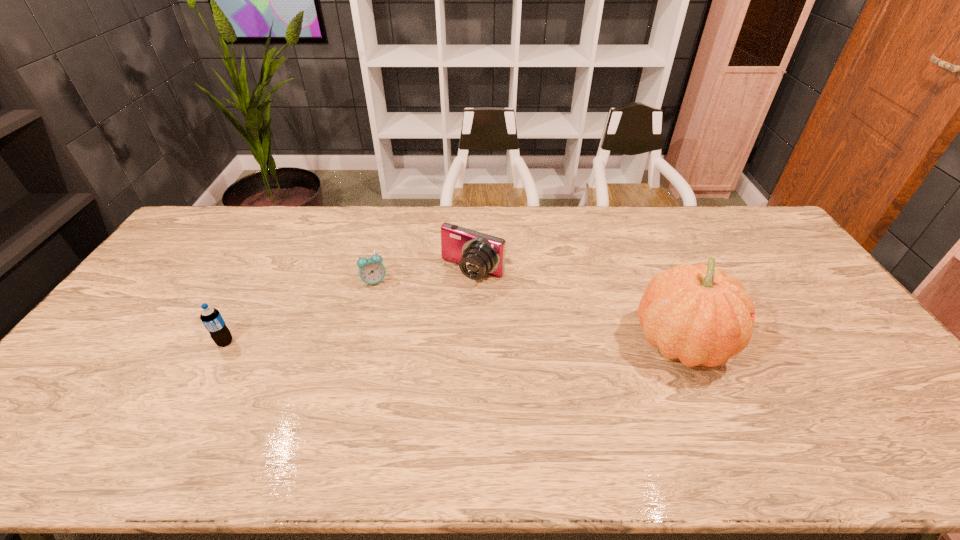
Locate an element on the screen. This screenshot has height=540, width=960. vacant space located on the front-facing side of the second object from right to left is located at coordinates (419, 341).

I want to click on blank area located 0.320m on the face of the shortest object, so click(433, 354).

Where is `vacant point located 0.240m on the face of the shortest object`? vacant point located 0.240m on the face of the shortest object is located at coordinates click(419, 335).

Find the location of a particular element. free space located 0.180m on the face of the shortest object is located at coordinates (408, 322).

The height and width of the screenshot is (540, 960). In the image, there is a desktop. Find the location of `vacant space at the far edge`. vacant space at the far edge is located at coordinates (663, 217).

Locate an element on the screen. vacant space at the near edge of the desktop is located at coordinates (777, 390).

Locate an element on the screen. The width and height of the screenshot is (960, 540). vacant space at the left edge of the desktop is located at coordinates (108, 338).

Image resolution: width=960 pixels, height=540 pixels. I want to click on vacant space at the right edge, so click(x=853, y=328).

Where is `blank space at the near left corner of the desktop`? This screenshot has width=960, height=540. blank space at the near left corner of the desktop is located at coordinates (87, 417).

The height and width of the screenshot is (540, 960). I want to click on free space between the shortest object and the third object from left to right, so click(423, 278).